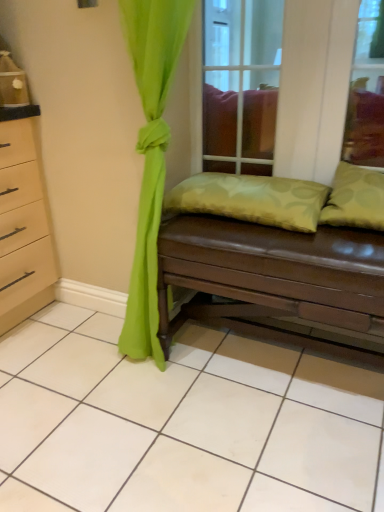
Question: Is transparent glass door at center bigger or smaller than green fabric pillow at right, arranged as the first pillow when viewed from the right?

Choices:
 (A) big
 (B) small

Answer: (A)

Question: Based on their positions, is transparent glass door at center located to the left or right of green fabric pillow at right, acting as the 2th pillow starting from the left?

Choices:
 (A) right
 (B) left

Answer: (B)

Question: Which of these objects is positioned farthest from the green fabric pillow at right, acting as the 2th pillow starting from the left?

Choices:
 (A) green textured pillow at center, the 2th pillow viewed from the right
 (B) brown leather studio couch at center
 (C) transparent glass door at center

Answer: (C)

Question: Estimate the real-world distances between objects in this image. Which object is farther from the green fabric pillow at right, acting as the 2th pillow starting from the left?

Choices:
 (A) green textured pillow at center, placed as the 1th pillow when sorted from left to right
 (B) brown leather studio couch at center
 (C) transparent glass door at center

Answer: (C)